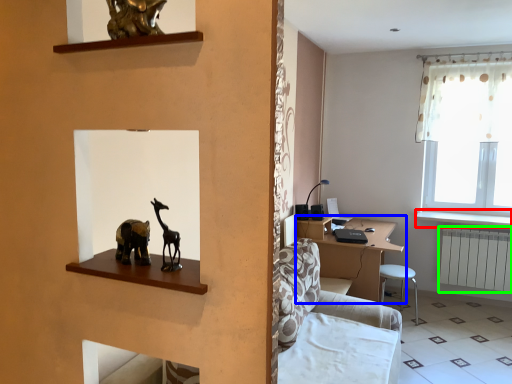
Question: Considering the real-world distances, which object is closest to window sill (highlighted by a red box)? table (highlighted by a blue box) or radiator (highlighted by a green box).

Choices:
 (A) table
 (B) radiator

Answer: (B)